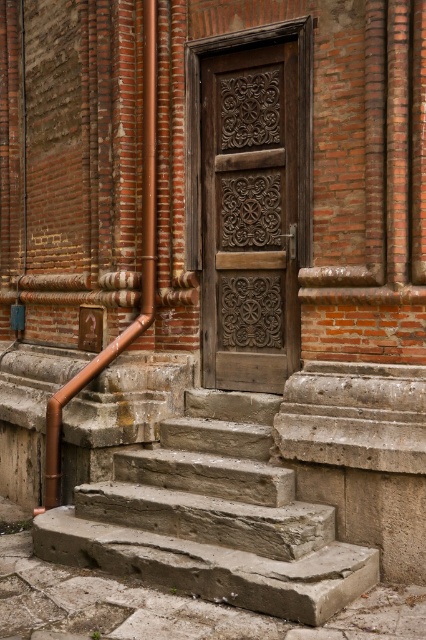
Based on the photo, you are standing at the base of the stone steps leading to the wooden door. You need to place a small potted plant between the two points labeled as point (230,67) and point (123,349). Which point should the plant be closer to if it needs to be placed closer to the wooden door?

The plant should be closer to point (230,67) because it is in front of point (123,349), meaning it is closer to the wooden door.

You are a maintenance worker needing to reach both the gray stone stairs at center and the copper pipe at left. Given that your ladder is 5 feet long, can you safely reach both objects without moving the ladder?

The gray stone stairs at center and the copper pipe at left are 5.02 feet apart from each other. Since the ladder is only 5 feet long, the distance between the two objects exceeds the ladder length, so you cannot safely reach both without moving the ladder.

You are a delivery person carrying a heavy package and need to reach the carved wood door at center. The gray stone stairs at center are in your path. Are the stairs leading up to the door or down from it?

The gray stone stairs at center is in front of carved wood door at center, so the stairs are leading up to the door since they are positioned in front of it from the viewer perspective.